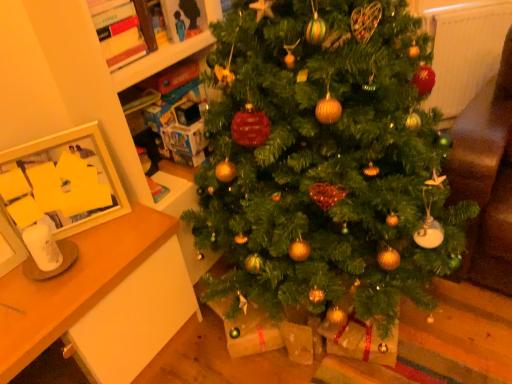
Locate an element on the screen. free spot above white textured radiator at upper right (from a real-world perspective) is located at coordinates (464, 4).